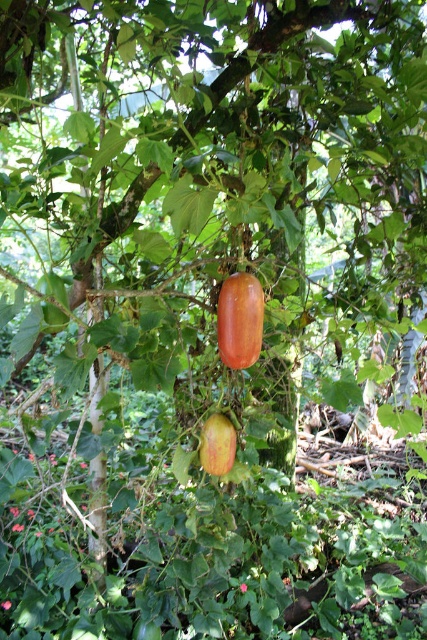
Question: Can you confirm if shiny orange squash at center is positioned above green matte apple at center?

Choices:
 (A) no
 (B) yes

Answer: (B)

Question: Which of the following is the closest to the observer?

Choices:
 (A) shiny orange squash at center
 (B) green matte apple at center

Answer: (A)

Question: Which point is farther to the camera?

Choices:
 (A) shiny orange squash at center
 (B) green matte apple at center

Answer: (B)

Question: Can you confirm if shiny orange squash at center is positioned below green matte apple at center?

Choices:
 (A) yes
 (B) no

Answer: (B)

Question: Does shiny orange squash at center appear over green matte apple at center?

Choices:
 (A) no
 (B) yes

Answer: (B)

Question: Which point is closer to the camera?

Choices:
 (A) green matte apple at center
 (B) shiny orange squash at center

Answer: (B)